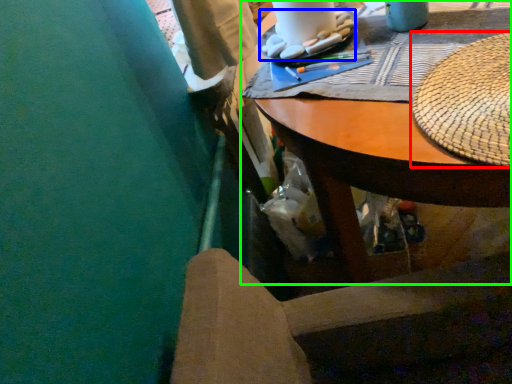
Question: Considering the real-world distances, which object is closest to hat (highlighted by a red box)? food (highlighted by a blue box) or desk (highlighted by a green box).

Choices:
 (A) food
 (B) desk

Answer: (B)